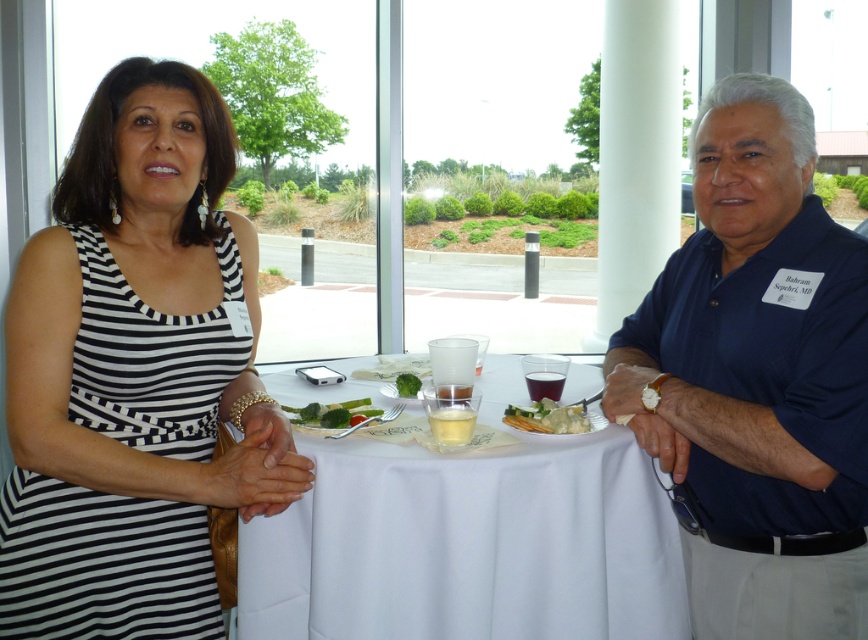
Locate an element on the screen. Image resolution: width=868 pixels, height=640 pixels. navy blue shirt at center is located at coordinates (757, 378).

Is point (773, 593) farther from camera compared to point (569, 381)?

No, (773, 593) is closer to viewer.

What are the coordinates of `navy blue shirt at center` in the screenshot? It's located at (757, 378).

Which is more to the right, white creamy sauce at center or green leafy vegetable at center?

Positioned to the right is white creamy sauce at center.

Can you confirm if white creamy sauce at center is wider than green leafy vegetable at center?

Correct, the width of white creamy sauce at center exceeds that of green leafy vegetable at center.

Which is behind, point (520, 419) or point (411, 374)?

Positioned behind is point (411, 374).

Identify the location of white creamy sauce at center. (547, 417).

Can you confirm if white cloth table at center is positioned to the right of green leafy vegetable at center?

Indeed, white cloth table at center is positioned on the right side of green leafy vegetable at center.

How much distance is there between white cloth table at center and green leafy vegetable at center?

white cloth table at center and green leafy vegetable at center are 14.74 inches apart.

Who is more forward, (498, 406) or (400, 385)?

Point (498, 406) is more forward.

Locate an element on the screen. This screenshot has width=868, height=640. white cloth table at center is located at coordinates (468, 545).